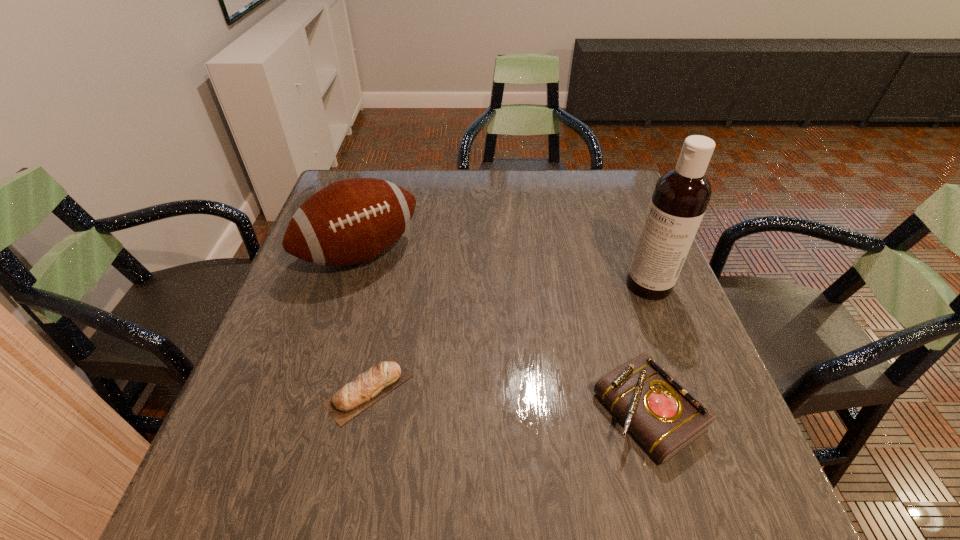
Locate an element on the screen. vacant region located 0.190m on the label side of the tallest object is located at coordinates (578, 334).

The image size is (960, 540). Identify the location of free region located 0.190m on the label side of the tallest object. (578, 334).

The image size is (960, 540). Find the location of `pita bread positioned at the near edge`. pita bread positioned at the near edge is located at coordinates (367, 388).

At what (x,y) coordinates should I click in order to perform the action: click on diary located at the near edge. Please return your answer as a coordinate pair (x, y). The height and width of the screenshot is (540, 960). Looking at the image, I should click on (665, 417).

You are a GUI agent. You are given a task and a screenshot of the screen. Output one action in this format:
    pyautogui.click(x=<x>, y=<y>)
    Task: Click on the pita bread present at the left edge
    
    Given the screenshot: What is the action you would take?
    pyautogui.click(x=367, y=388)

Find the location of a particular element. football present at the left edge is located at coordinates (351, 221).

Where is `diary at the right edge`? Image resolution: width=960 pixels, height=540 pixels. diary at the right edge is located at coordinates (665, 417).

At what (x,y) coordinates should I click in order to perform the action: click on dishwasher detergent present at the right edge. Please return your answer as a coordinate pair (x, y). The width and height of the screenshot is (960, 540). Looking at the image, I should click on (681, 195).

Identify the location of object that is at the near left corner. This screenshot has width=960, height=540. (367, 388).

Image resolution: width=960 pixels, height=540 pixels. I want to click on object at the near right corner, so click(665, 417).